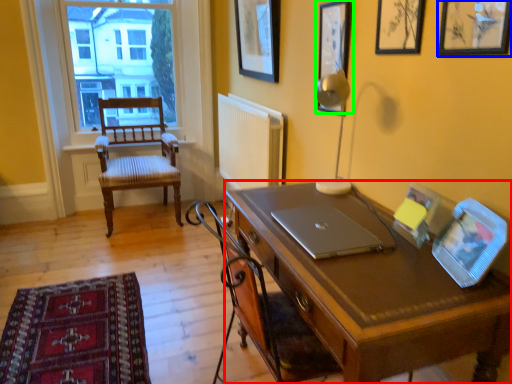
Question: Which is nearer to the desk (highlighted by a red box)? picture frame (highlighted by a blue box) or picture frame (highlighted by a green box).

Choices:
 (A) picture frame
 (B) picture frame

Answer: (A)